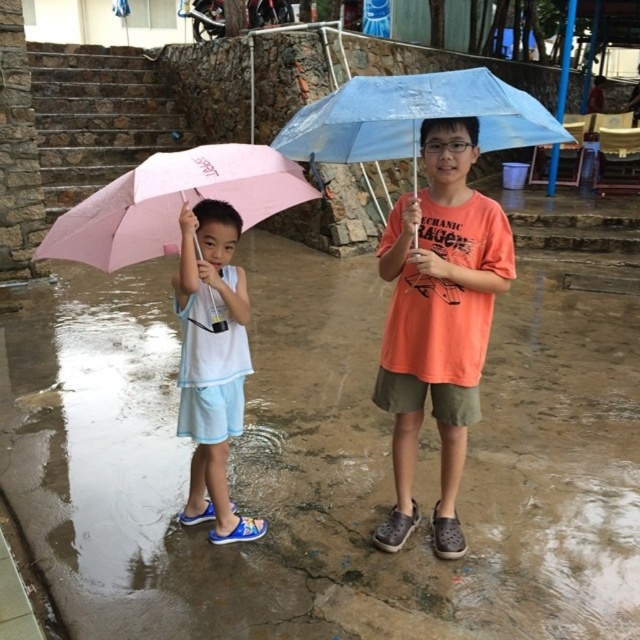
Consider the image. You are a delivery robot with a package that needs to be handed over to the child at the left. The robot has a delivery arm that can reach 3 feet. Can the delivery arm reach the white matte shirt at left if the pink fabric umbrella at left is blocking the path?

The pink fabric umbrella at left is 3.86 feet away from the white matte shirt at left. Since the delivery arm can only reach 3 feet, the distance is too far for the robot to deliver the package to the white matte shirt at left without moving closer.

You are a photographer trying to capture a shot of the two children in the rain. You notice the pink matte umbrella at left and the white matte shirt at left. Which object should you focus on first if you want to frame the leftmost part of the scene?

The pink matte umbrella at left is to the left of the white matte shirt at left, so you should focus on the pink matte umbrella at left first to capture the leftmost part of the scene.